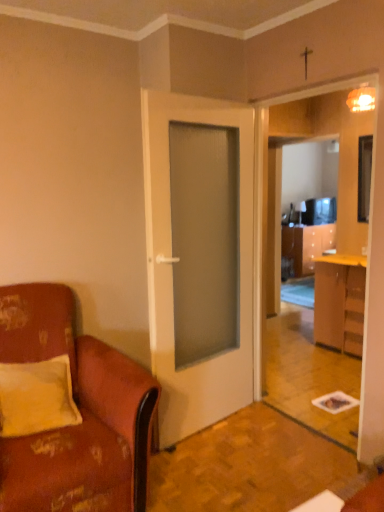
This screenshot has height=512, width=384. I want to click on vacant area situated below white matte door at center (from a real-world perspective), so click(x=211, y=429).